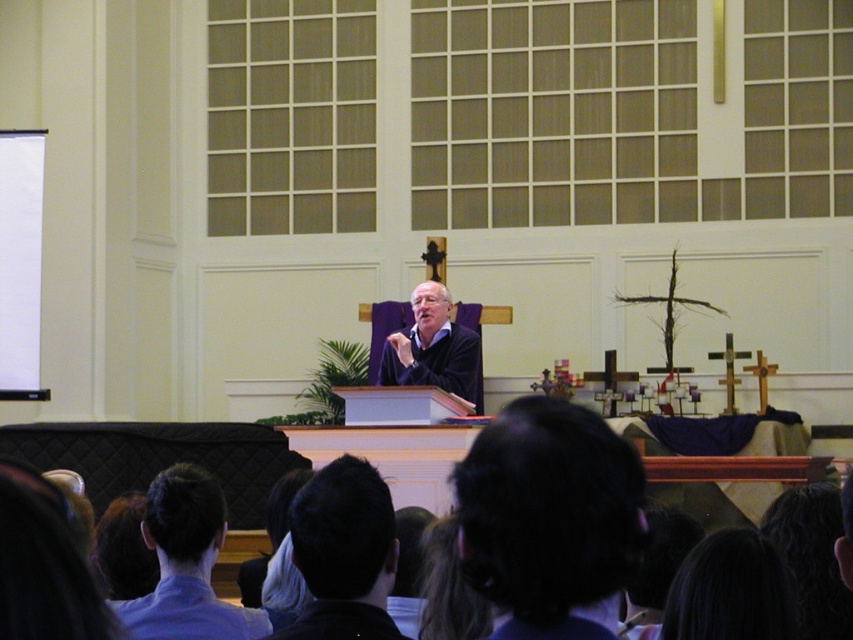
Question: Which point appears farthest from the camera in this image?

Choices:
 (A) (677, 573)
 (B) (456, 349)

Answer: (B)

Question: Does blue shirt at lower left have a greater width compared to dark blue fabric at center?

Choices:
 (A) no
 (B) yes

Answer: (A)

Question: Among these objects, which one is nearest to the camera?

Choices:
 (A) dark blue fabric at center
 (B) dark brown hair at center

Answer: (B)

Question: Does dark brown hair at lower center appear over dark hair at lower center?

Choices:
 (A) no
 (B) yes

Answer: (B)

Question: Based on their relative distances, which object is farther from the dark blue fabric at center?

Choices:
 (A) blue shirt at lower left
 (B) dark brown hair at lower center
 (C) dark brown hair at center
 (D) dark hair at lower center

Answer: (D)

Question: Does blue shirt at lower left have a larger size compared to dark blue fabric at center?

Choices:
 (A) yes
 (B) no

Answer: (B)